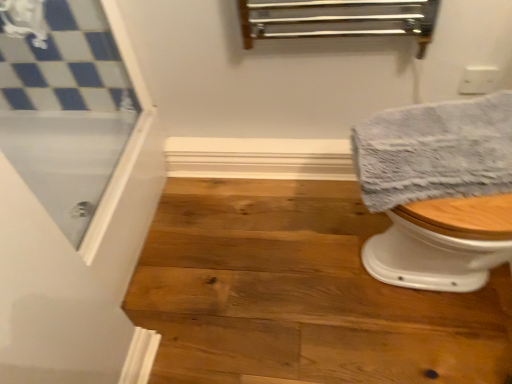
The width and height of the screenshot is (512, 384). I want to click on natural wood stair at lower right, so coord(300,294).

In order to face clear glass screen door at upper left, should I rotate leftwards or rightwards?

You should look left and rotate roughly 22.190 degrees.

What do you see at coordinates (435, 151) in the screenshot? I see `gray textured towel at right` at bounding box center [435, 151].

Find the location of a particular element. natural wood stair at lower right is located at coordinates (300, 294).

In terms of width, does natural wood stair at lower right look wider or thinner when compared to gray textured towel at right?

Considering their sizes, natural wood stair at lower right looks broader than gray textured towel at right.

Which is more to the left, natural wood stair at lower right or gray textured towel at right?

natural wood stair at lower right is more to the left.

Measure the distance from natural wood stair at lower right to gray textured towel at right.

A distance of 19.78 inches exists between natural wood stair at lower right and gray textured towel at right.

Find the location of a particular element. The image size is (512, 384). stair that is on the left side of gray textured towel at right is located at coordinates (300, 294).

Does clear glass screen door at upper left turn towards gray textured towel at right?

Yes, clear glass screen door at upper left is facing gray textured towel at right.

The width and height of the screenshot is (512, 384). Find the location of `towel on the right of clear glass screen door at upper left`. towel on the right of clear glass screen door at upper left is located at coordinates (435, 151).

From the picture: Which of these two, clear glass screen door at upper left or gray textured towel at right, stands taller?

With more height is clear glass screen door at upper left.

From the image's perspective, is clear glass screen door at upper left beneath gray textured towel at right?

No, from the image's perspective, clear glass screen door at upper left is not beneath gray textured towel at right.

Is natural wood stair at lower right to the left of clear glass screen door at upper left from the viewer's perspective?

No.

Consider the image. Is natural wood stair at lower right positioned beyond the bounds of clear glass screen door at upper left?

Yes.

Who is smaller, natural wood stair at lower right or clear glass screen door at upper left?

clear glass screen door at upper left.

Is natural wood stair at lower right turned away from clear glass screen door at upper left?

No, clear glass screen door at upper left is not at the back of natural wood stair at lower right.

Between clear glass screen door at upper left and natural wood stair at lower right, which one has larger size?

natural wood stair at lower right is bigger.

Image resolution: width=512 pixels, height=384 pixels. I want to click on screen door on the left of natural wood stair at lower right, so click(x=66, y=111).

Is clear glass screen door at upper left touching natural wood stair at lower right?

clear glass screen door at upper left and natural wood stair at lower right are not in contact.

Which of these two, clear glass screen door at upper left or natural wood stair at lower right, stands taller?

Standing taller between the two is clear glass screen door at upper left.

Is gray textured towel at right turned away from natural wood stair at lower right?

No, natural wood stair at lower right is not at the back of gray textured towel at right.

Identify the location of towel in front of the natural wood stair at lower right. (435, 151).

Considering the relative positions of gray textured towel at right and natural wood stair at lower right in the image provided, is gray textured towel at right to the left or to the right of natural wood stair at lower right?

From the image, it's evident that gray textured towel at right is to the right of natural wood stair at lower right.

From the image's perspective, is gray textured towel at right under natural wood stair at lower right?

No, from the image's perspective, gray textured towel at right is not beneath natural wood stair at lower right.

From the image's perspective, does gray textured towel at right appear lower than clear glass screen door at upper left?

Yes, from the image's perspective, gray textured towel at right is below clear glass screen door at upper left.

Measure the distance between gray textured towel at right and clear glass screen door at upper left.

37.93 inches.

Considering the positions of point (388, 162) and point (2, 137), is point (388, 162) closer or farther from the camera than point (2, 137)?

Point (388, 162) appears to be closer to the viewer than point (2, 137).

Identify the location of towel in front of the natural wood stair at lower right. (435, 151).

Image resolution: width=512 pixels, height=384 pixels. I want to click on screen door that appears above the gray textured towel at right (from a real-world perspective), so click(x=66, y=111).

Which object lies further to the anchor point gray textured towel at right, natural wood stair at lower right or clear glass screen door at upper left?

Among the two, clear glass screen door at upper left is located further to gray textured towel at right.

From the picture: When comparing their distances from natural wood stair at lower right, does clear glass screen door at upper left or gray textured towel at right seem closer?

gray textured towel at right.

Estimate the real-world distances between objects in this image. Which object is closer to gray textured towel at right, clear glass screen door at upper left or natural wood stair at lower right?

The object closer to gray textured towel at right is natural wood stair at lower right.

Which object lies nearer to the anchor point natural wood stair at lower right, gray textured towel at right or clear glass screen door at upper left?

gray textured towel at right lies closer to natural wood stair at lower right than the other object.

Which object lies further to the anchor point clear glass screen door at upper left, gray textured towel at right or natural wood stair at lower right?

gray textured towel at right is further to clear glass screen door at upper left.

Which object lies further to the anchor point clear glass screen door at upper left, natural wood stair at lower right or gray textured towel at right?

The object further to clear glass screen door at upper left is gray textured towel at right.

This screenshot has height=384, width=512. In order to click on stair between clear glass screen door at upper left and gray textured towel at right in this screenshot , I will do `click(300, 294)`.